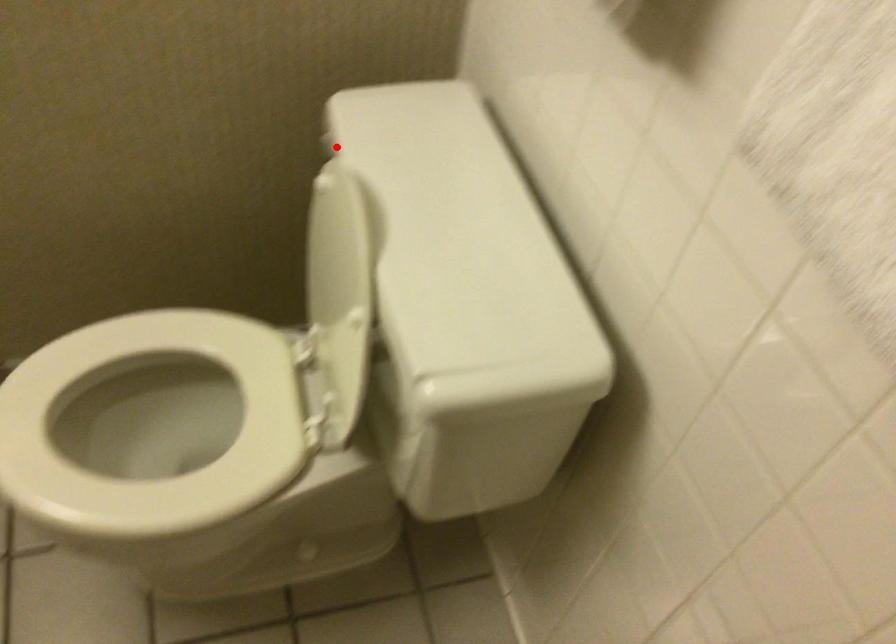
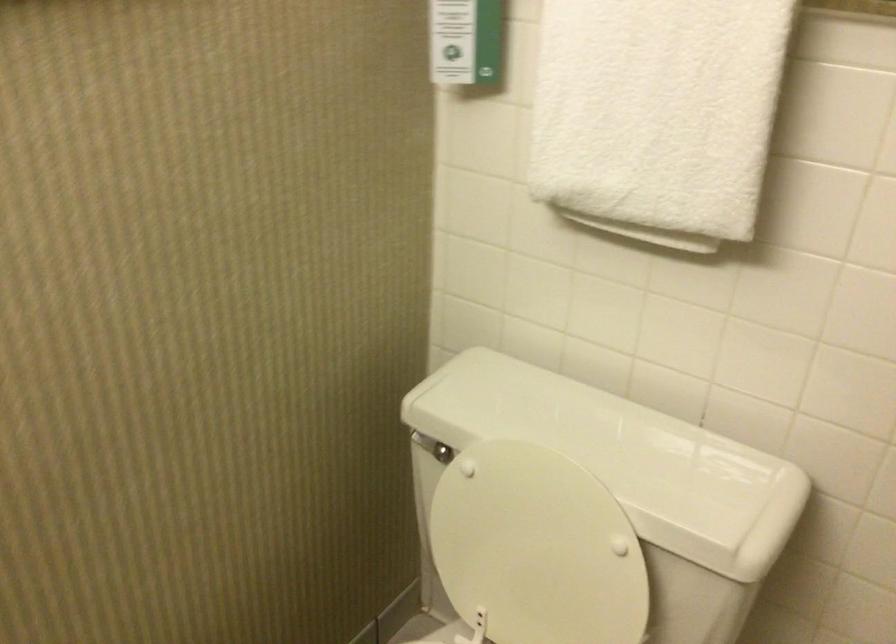
Where in the second image is the point corresponding to the highlighted location from the first image?

(425, 444)